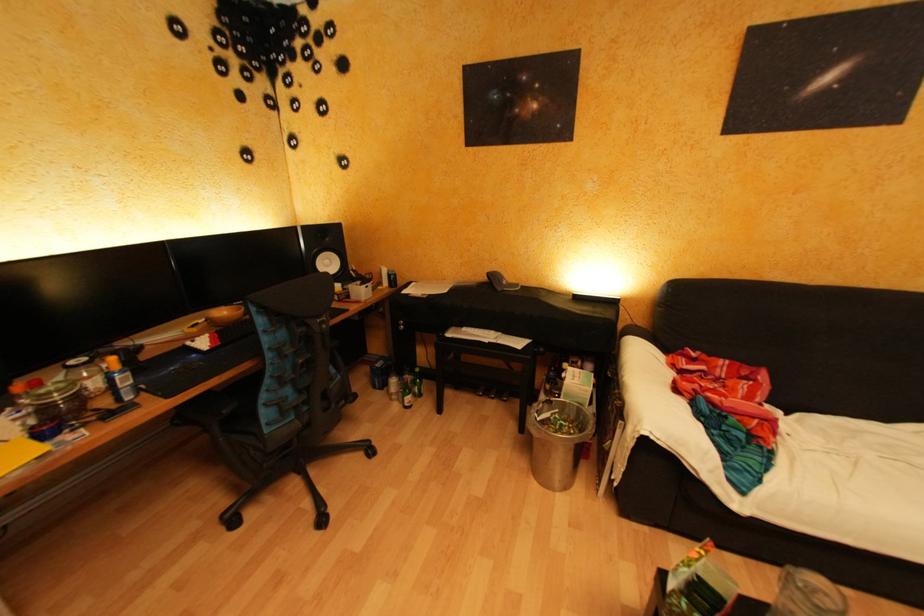
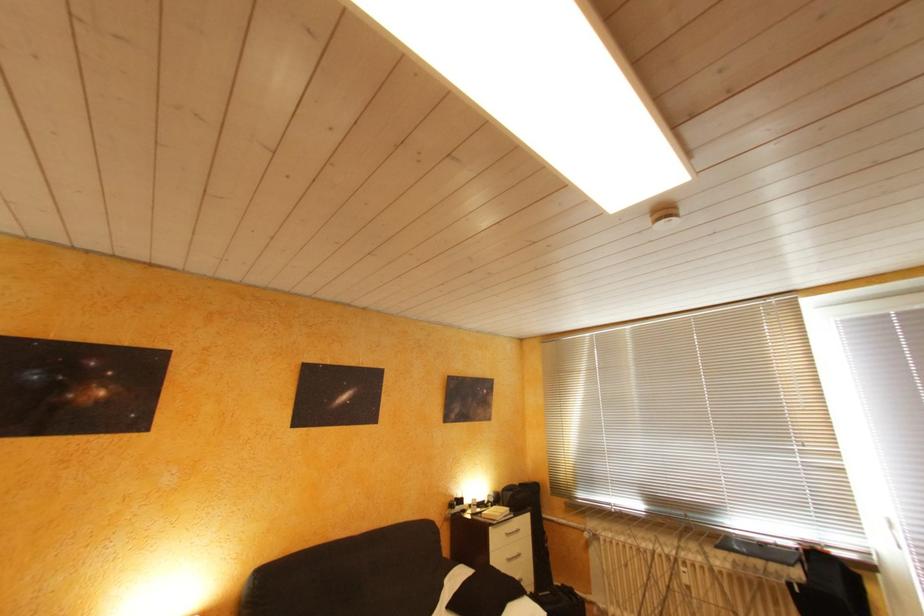
How did the camera likely rotate?

The rotation direction of the camera is right-up.